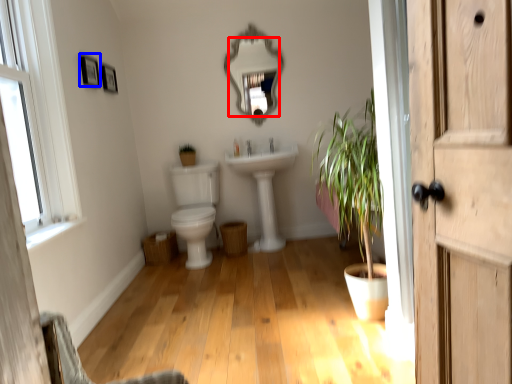
Question: Which object appears farthest to the camera in this image, mirror (highlighted by a red box) or picture frame (highlighted by a blue box)?

Choices:
 (A) mirror
 (B) picture frame

Answer: (A)